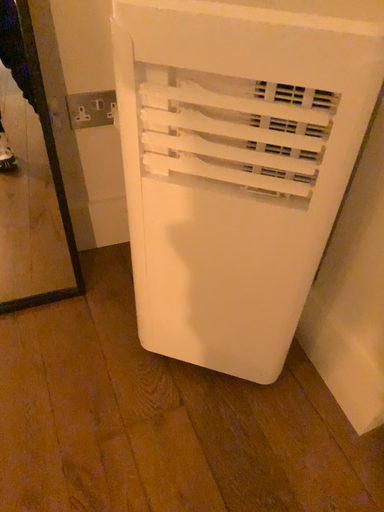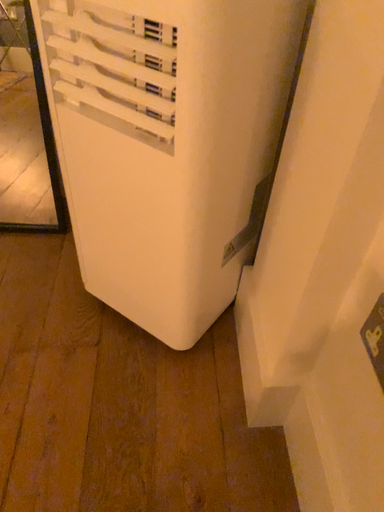
Question: Which way did the camera rotate in the video?

Choices:
 (A) rotated left
 (B) rotated right

Answer: (A)